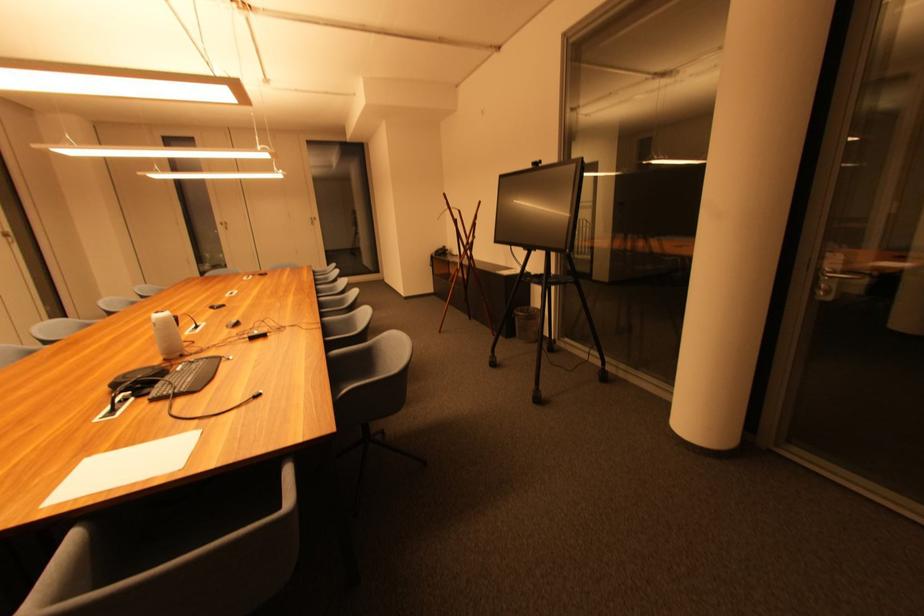
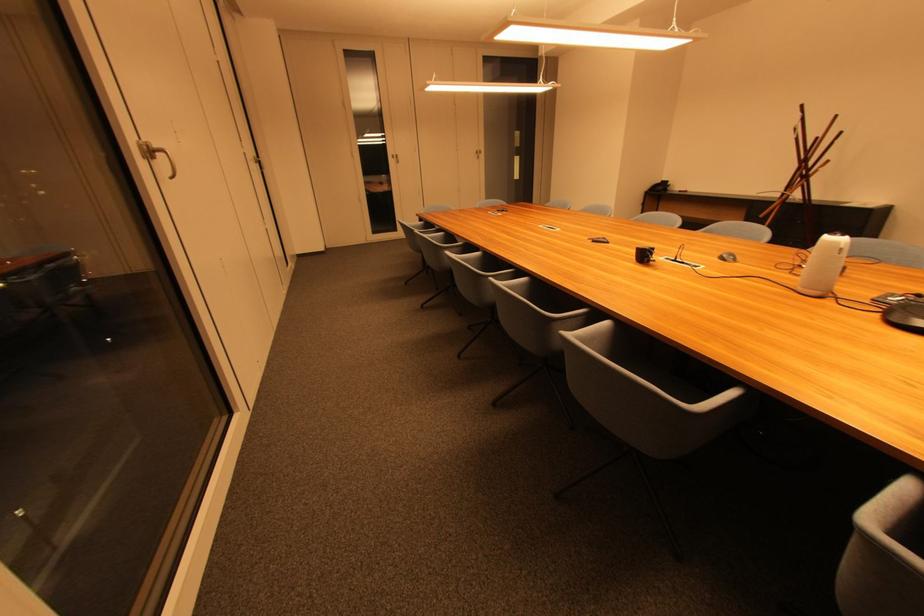
Question: What movement of the cameraman would produce the second image?

Choices:
 (A) Left
 (B) Right
 (C) Forward
 (D) Backward

Answer: (A)